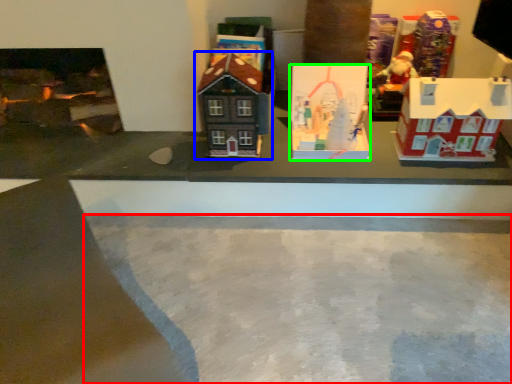
Question: Which object is positioned farthest from concrete (highlighted by a red box)? Select from toy (highlighted by a blue box) and toy (highlighted by a green box).

Choices:
 (A) toy
 (B) toy

Answer: (A)